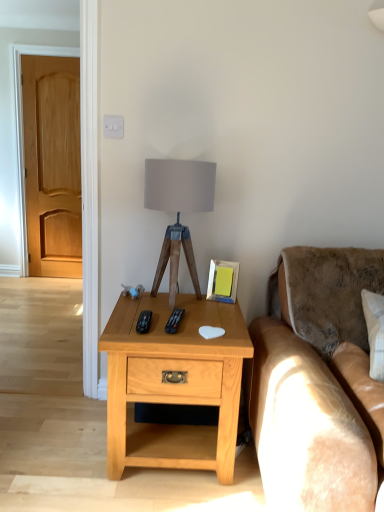
At what (x,y) coordinates should I click in order to perform the action: click on vacant space to the right of black plastic remote at center, the 2th remote when ordered from left to right. Please return your answer as a coordinate pair (x, y). The image size is (384, 512). Looking at the image, I should click on (215, 318).